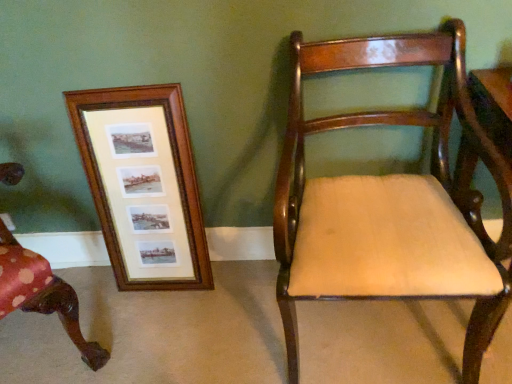
This screenshot has width=512, height=384. Identify the location of spots to the right of wooden chair at left, which is counted as the second chair, starting from the right. (154, 324).